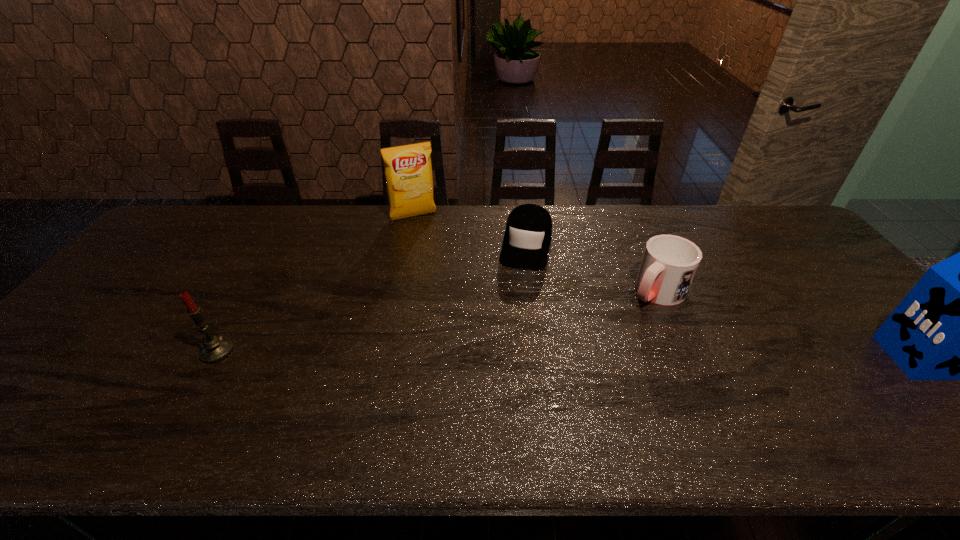
Where is `the leftmost object`? The width and height of the screenshot is (960, 540). the leftmost object is located at coordinates (214, 348).

I want to click on the third tallest object, so click(214, 348).

The image size is (960, 540). I want to click on the fourth tallest object, so click(669, 263).

Find the location of a particular element. mug is located at coordinates (669, 263).

This screenshot has height=540, width=960. I want to click on the shortest object, so click(x=527, y=238).

What are the coordinates of `the third object from right to left` in the screenshot? It's located at (527, 238).

Find the location of `the fourth object from right to left`. the fourth object from right to left is located at coordinates (408, 171).

The height and width of the screenshot is (540, 960). Identify the location of the fourth shortest object. (408, 171).

Image resolution: width=960 pixels, height=540 pixels. I want to click on free spot located 0.190m on the right of the third shortest object, so click(310, 351).

I want to click on vacant space located on the side of the second shortest object with the handle, so click(x=557, y=382).